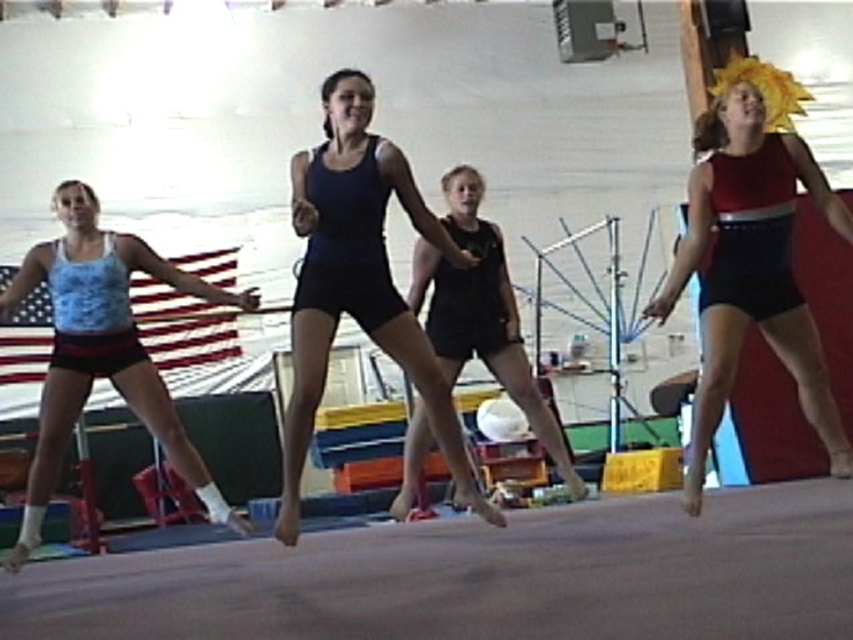
Question: Which object is farther from the camera taking this photo?

Choices:
 (A) matte blue leotard at center
 (B) matte red leotard at right
 (C) black matte shorts at center
 (D) blue fabric tank top at left

Answer: (C)

Question: In this image, where is matte red leotard at right located relative to matte blue leotard at center?

Choices:
 (A) above
 (B) below

Answer: (A)

Question: Is matte red leotard at right further to the viewer compared to black matte shorts at center?

Choices:
 (A) no
 (B) yes

Answer: (A)

Question: Can you confirm if matte blue leotard at center is positioned to the left of blue fabric tank top at left?

Choices:
 (A) yes
 (B) no

Answer: (B)

Question: Which object appears farthest from the camera in this image?

Choices:
 (A) black matte shorts at center
 (B) blue fabric tank top at left
 (C) matte blue leotard at center
 (D) matte red leotard at right

Answer: (A)

Question: Estimate the real-world distances between objects in this image. Which object is closer to the blue fabric tank top at left?

Choices:
 (A) matte blue leotard at center
 (B) matte red leotard at right

Answer: (A)